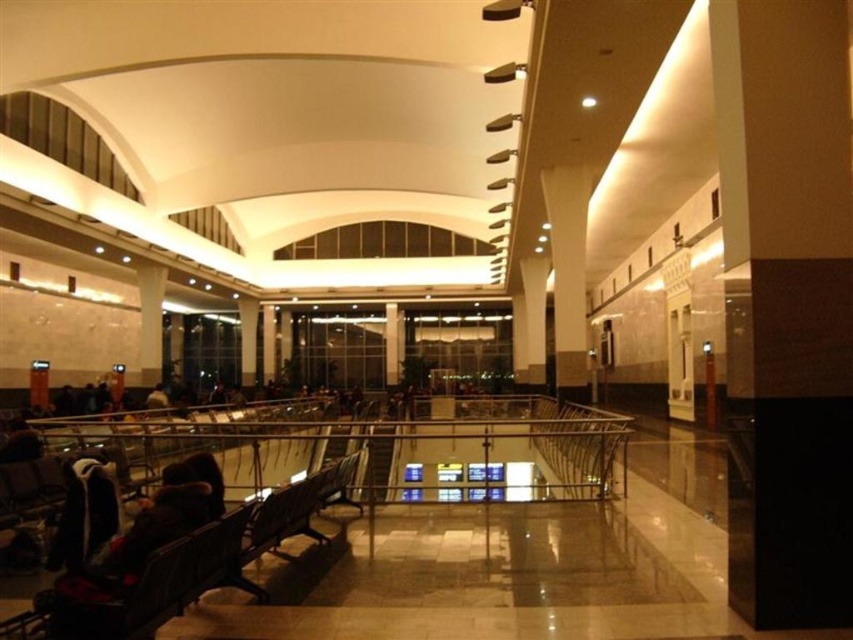
Between black polished stone pillar at right and dark brown leather jacket at center, which one is positioned higher?

black polished stone pillar at right is above.

Is black polished stone pillar at right above dark brown leather jacket at center?

Yes.

Looking at this image, who is more distant from viewer, (741, 86) or (154, 387)?

The point (154, 387) is more distant.

The height and width of the screenshot is (640, 853). Find the location of `black polished stone pillar at right`. black polished stone pillar at right is located at coordinates (786, 305).

Is white glossy pillar at center below dark brown leather jacket at center?

Incorrect, white glossy pillar at center is not positioned below dark brown leather jacket at center.

Is white glossy pillar at center further to camera compared to dark brown leather jacket at center?

No, white glossy pillar at center is closer to the viewer.

Image resolution: width=853 pixels, height=640 pixels. Identify the location of white glossy pillar at center. (567, 273).

Does point (769, 621) come behind point (552, 237)?

No, (769, 621) is closer to viewer.

Based on the photo, does black polished stone pillar at right lie in front of white glossy pillar at center?

Yes, black polished stone pillar at right is closer to the viewer.

Who is more distant from viewer, (x=845, y=138) or (x=576, y=312)?

Positioned behind is point (x=576, y=312).

The image size is (853, 640). I want to click on black polished stone pillar at right, so click(x=786, y=305).